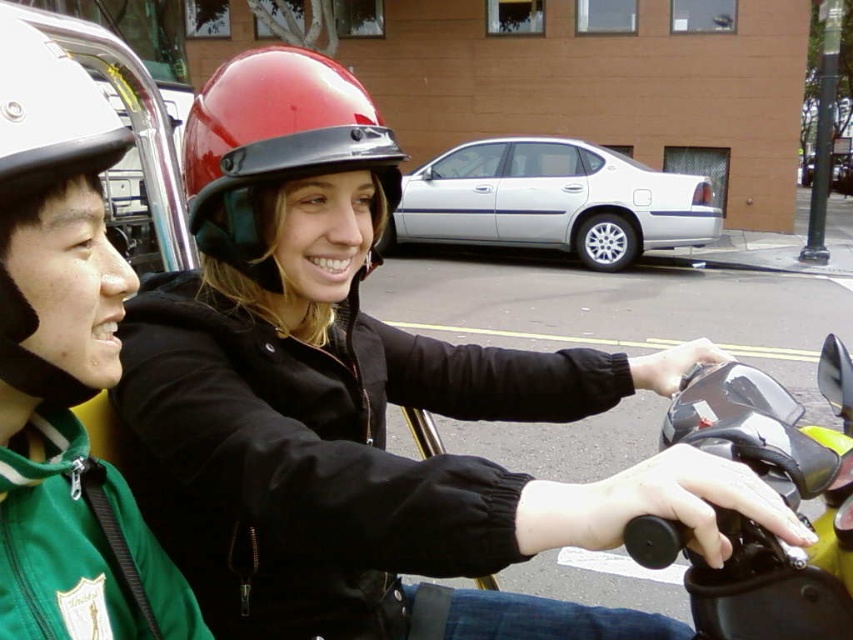
You are a city planner analyzing traffic patterns. You need to determine the position of the shiny black handlebars at center in the image. What are their coordinates?

The coordinates of the shiny black handlebars at center are at point (778,492).

You are a delivery person who needs to choose a helmet for a scooter ride. You have two options in the image, the red glossy helmet at center and the white matte helmet at left. Based on their appearance, which helmet might provide a wider coverage for your head?

The red glossy helmet at center might provide wider coverage for your head since it is wider than the white matte helmet at left according to the description.